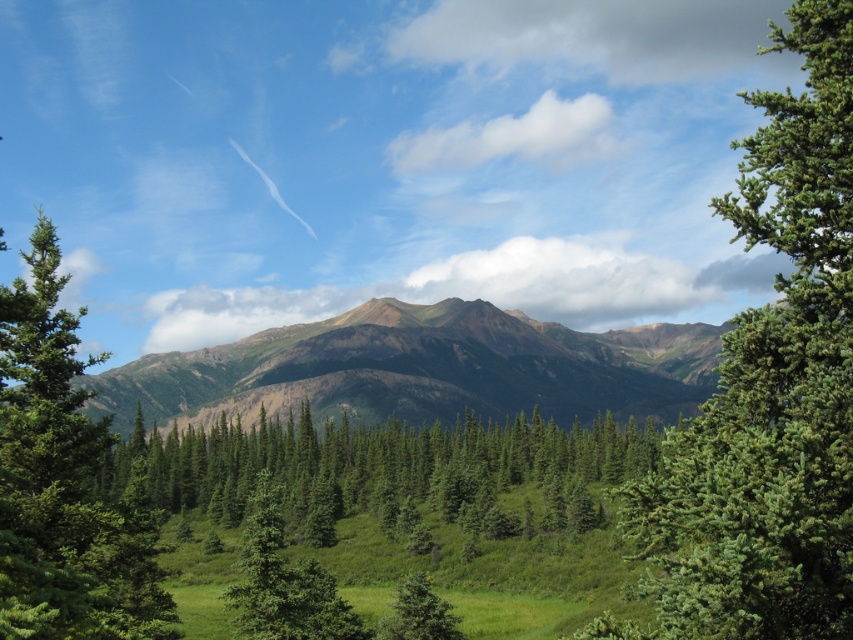
Question: Based on their relative distances, which object is nearer to the green textured pine tree at center?

Choices:
 (A) green matte tree at left
 (B) green matte tree at center

Answer: (A)

Question: Is green textured pine tree at center closer to the viewer compared to rustic brown mountain range at center?

Choices:
 (A) yes
 (B) no

Answer: (A)

Question: Does green textured pine tree at center appear on the left side of green matte tree at left?

Choices:
 (A) no
 (B) yes

Answer: (A)

Question: Which point appears farthest from the camera in this image?

Choices:
 (A) (840, 460)
 (B) (579, 448)
 (C) (16, 595)

Answer: (B)

Question: Among these points, which one is nearest to the camera?

Choices:
 (A) (440, 440)
 (B) (659, 550)
 (C) (389, 369)

Answer: (B)

Question: Is rustic brown mountain range at center below green matte tree at left?

Choices:
 (A) yes
 (B) no

Answer: (A)